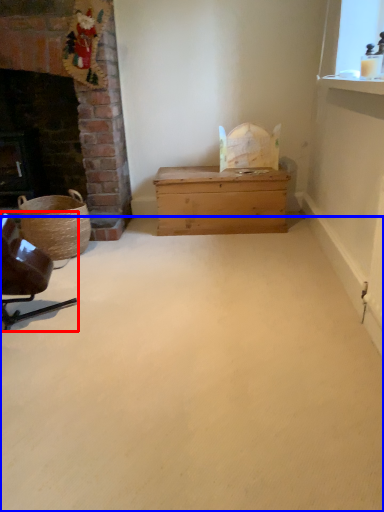
Question: Which object appears farthest to the camera in this image, chair (highlighted by a red box) or plain (highlighted by a blue box)?

Choices:
 (A) chair
 (B) plain

Answer: (A)